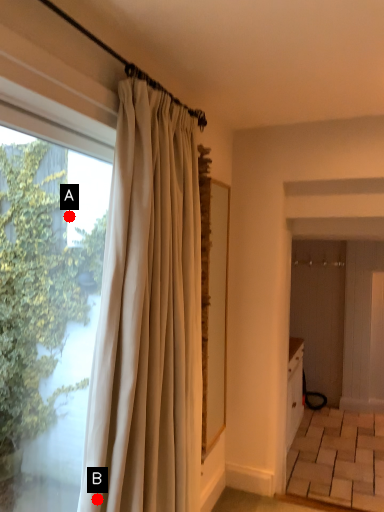
Question: Two points are circled on the image, labeled by A and B beside each circle. Among these points, which one is farthest from the camera?

Choices:
 (A) A is further
 (B) B is further

Answer: (A)